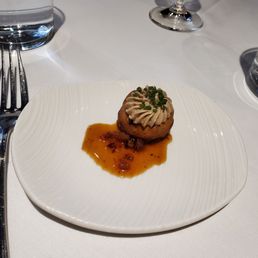
Find the location of a particular element. This screenshot has height=258, width=258. drinkin glass is located at coordinates (34, 12).